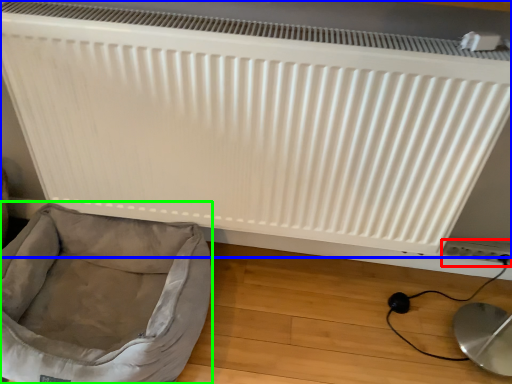
Question: Considering the real-world distances, which object is farthest from electric outlet (highlighted by a red box)? radiator (highlighted by a blue box) or dog bed (highlighted by a green box)?

Choices:
 (A) radiator
 (B) dog bed

Answer: (B)